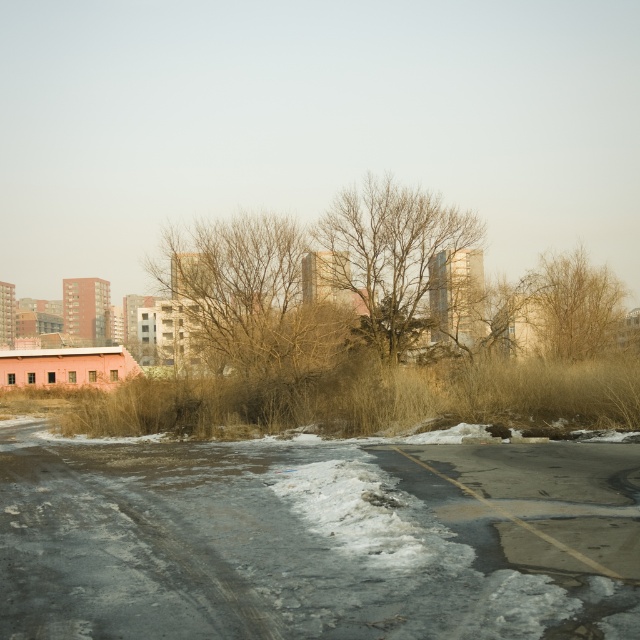
You are a delivery person trying to navigate through the urban area shown. You see the white powdery snow at center and the brown dry grass at right. Which of these two landmarks is located to the right of the other?

The brown dry grass at right is located to the right of the white powdery snow at center.

You are a city planner analyzing this urban area. You need to determine which of the two elements, the white powdery snow at center or the bare branches at center, occupies a wider area in the image. Based on the scene description, which one is wider?

The white powdery snow at center is wider than the bare branches at center.